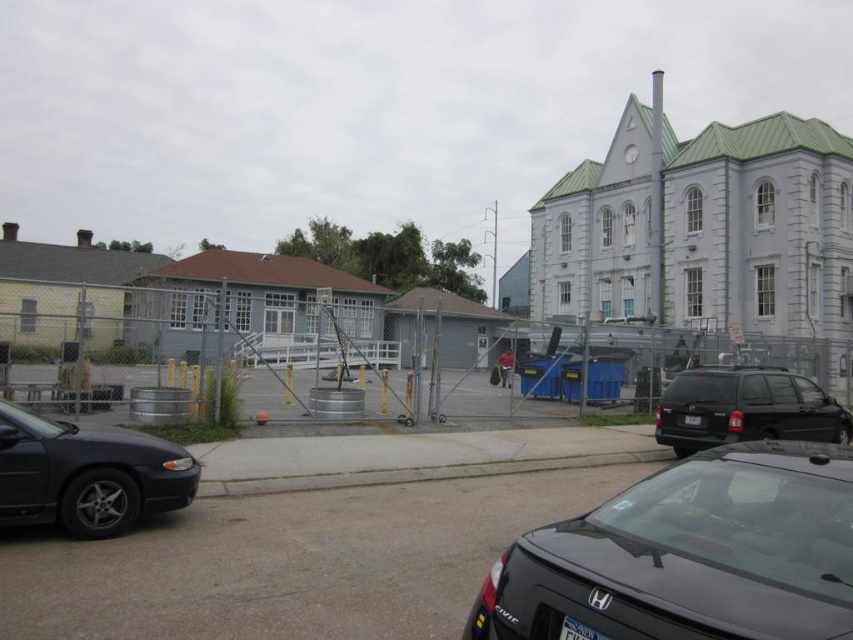
Does black asphalt parking lot at center have a lesser width compared to black matte van at center?

Indeed, black asphalt parking lot at center has a lesser width compared to black matte van at center.

Between point (229, 621) and point (656, 410), which one is positioned in front?

Point (229, 621) is in front.

What do you see at coordinates (291, 563) in the screenshot?
I see `black asphalt parking lot at center` at bounding box center [291, 563].

This screenshot has height=640, width=853. In order to click on black asphalt parking lot at center in this screenshot , I will do `click(291, 563)`.

Is the position of white stone church at upper right less distant than that of shiny black sedan at left?

No, it is not.

Who is shorter, white stone church at upper right or shiny black sedan at left?

shiny black sedan at left

Is point (718, 161) positioned after point (189, 493)?

Yes, point (718, 161) is behind point (189, 493).

Locate an element on the screen. The width and height of the screenshot is (853, 640). white stone church at upper right is located at coordinates (706, 234).

Can you confirm if black asphalt parking lot at center is positioned to the right of shiny black sedan at left?

Correct, you'll find black asphalt parking lot at center to the right of shiny black sedan at left.

What do you see at coordinates (291, 563) in the screenshot?
I see `black asphalt parking lot at center` at bounding box center [291, 563].

You are a GUI agent. You are given a task and a screenshot of the screen. Output one action in this format:
    pyautogui.click(x=<x>, y=<y>)
    Task: Click on the black asphalt parking lot at center
    
    Given the screenshot: What is the action you would take?
    pyautogui.click(x=291, y=563)